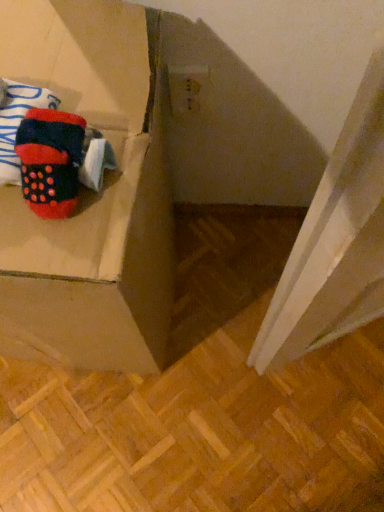
What do you see at coordinates (91, 195) in the screenshot? I see `cardboard box at left` at bounding box center [91, 195].

Image resolution: width=384 pixels, height=512 pixels. I want to click on cardboard box at left, so click(91, 195).

At what (x,y) coordinates should I click in order to perform the action: click on cardboard box at left. Please return your answer as a coordinate pair (x, y). The image size is (384, 512). Looking at the image, I should click on tap(91, 195).